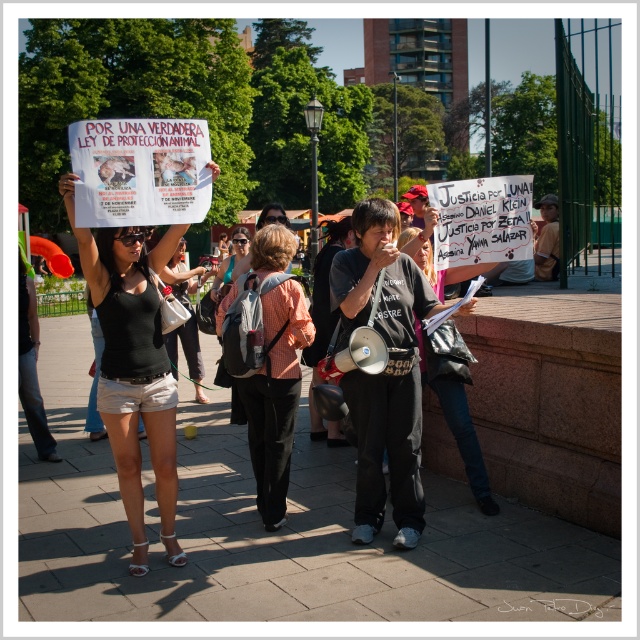
Is black fabric shorts at lower left to the right of orange checkered shirt at center from the viewer's perspective?

No, black fabric shorts at lower left is not to the right of orange checkered shirt at center.

Who is shorter, black fabric shorts at lower left or orange checkered shirt at center?

orange checkered shirt at center

Between point (113, 300) and point (269, 291), which one is positioned in front?

Positioned in front is point (113, 300).

Identify the location of black fabric shorts at lower left. This screenshot has width=640, height=640. (132, 368).

Is black fabric shorts at lower left below matte black tank top at center?

Correct, black fabric shorts at lower left is located below matte black tank top at center.

Does black fabric shorts at lower left lie in front of matte black tank top at center?

That is True.

Locate an element on the screen. black fabric shorts at lower left is located at coordinates (132, 368).

Who is higher up, orange checkered shirt at center or matte black tank top at center?

matte black tank top at center is higher up.

Is orange checkered shirt at center positioned behind matte black tank top at center?

No, it is not.

Who is more distant from viewer, (x=272, y=449) or (x=195, y=356)?

The point (x=195, y=356) is more distant.

This screenshot has width=640, height=640. Find the location of `orange checkered shirt at center`. orange checkered shirt at center is located at coordinates (280, 400).